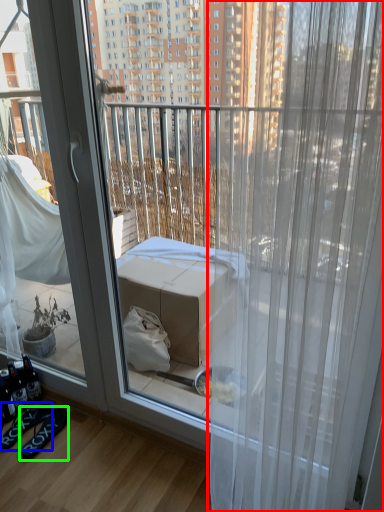
Question: Based on their relative distances, which object is farther from curtain (highlighted by a red box)? Choose from footwear (highlighted by a blue box) and footwear (highlighted by a green box).

Choices:
 (A) footwear
 (B) footwear

Answer: (A)